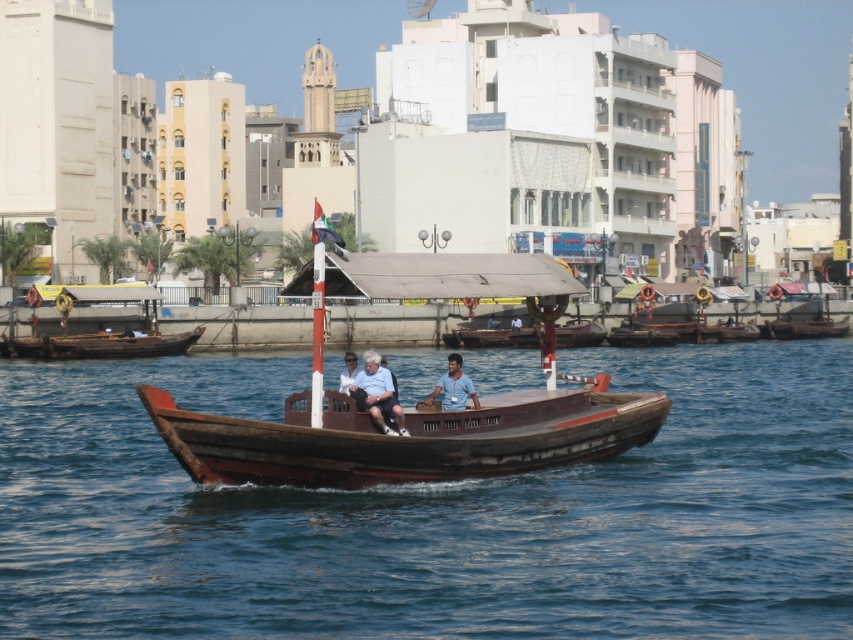
Consider the image. You are a passenger on the traditional wooden boat and want to move from the front to the back. Which point, point (86, 474) or point (553, 387), is closer to you when you start at the front?

Point (86, 474) is closer to you since it is further to the viewer than point (553, 387), meaning it is physically nearer to your starting position at the front of the boat.

You are a passenger on a boat trip and notice two boats in the distance. The scene shows a rustic wood boat at center and a wooden boat at left. Which boat is positioned lower in the image?

The rustic wood boat at center is positioned lower than the wooden boat at left in the image.

You are a photographer trying to capture a clear image of the wooden boat at left and the blue fabric shirt at center. Since you want both subjects to appear in the frame, which one should you zoom in on to ensure both are visible without cropping?

Since the wooden boat at left is bigger than the blue fabric shirt at center, you should zoom in on the wooden boat at left to ensure both are visible without cropping.